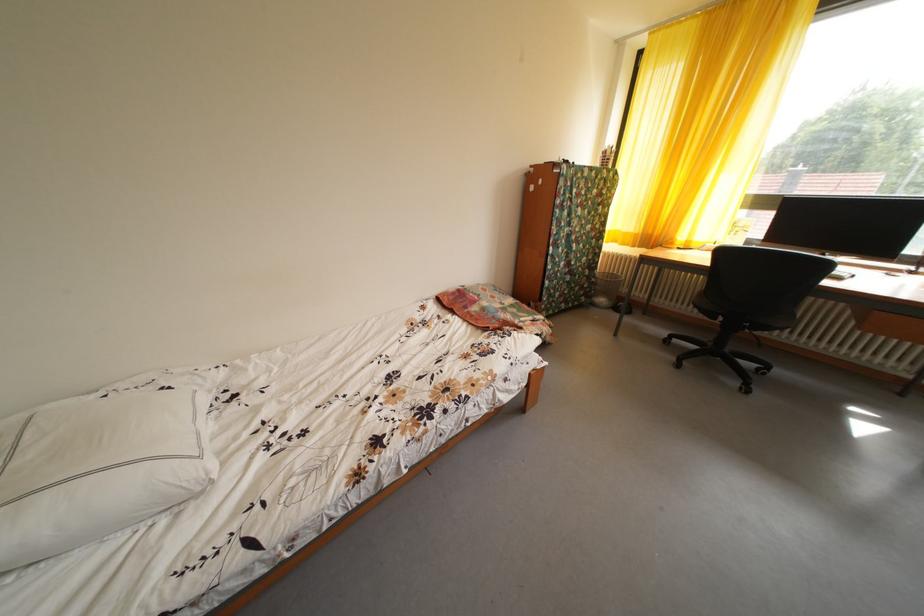
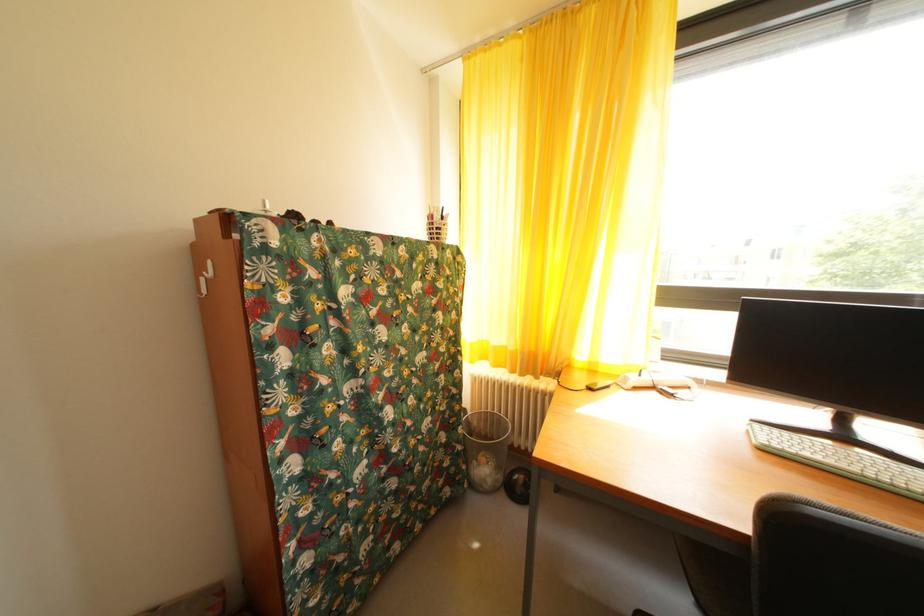
The point at (635, 240) is marked in the first image. Where is the corresponding point in the second image?

(505, 354)